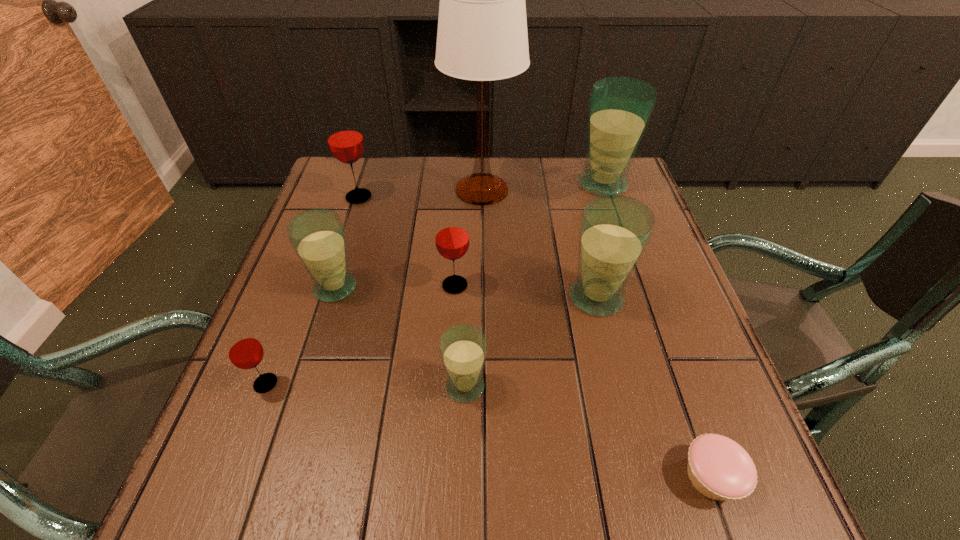
Where is `table lamp`? Image resolution: width=960 pixels, height=540 pixels. table lamp is located at coordinates [x=482, y=36].

Image resolution: width=960 pixels, height=540 pixels. I want to click on the farthest blue glass, so [x=620, y=108].

You are a GUI agent. You are given a task and a screenshot of the screen. Output one action in this format:
    pyautogui.click(x=<x>, y=<y>)
    Task: Click on the tallest glass
    
    Given the screenshot: What is the action you would take?
    pyautogui.click(x=620, y=108)

Where is `the biggest red glass`? the biggest red glass is located at coordinates (345, 140).

Find the location of a particular element. This screenshot has height=540, width=960. the second biggest blue glass is located at coordinates (614, 231).

You are a GUI agent. You are given a task and a screenshot of the screen. Output one action in this format:
    pyautogui.click(x=<x>, y=<y>)
    Task: Click on the rightmost red glass
    The height and width of the screenshot is (540, 960).
    Given the screenshot: What is the action you would take?
    pyautogui.click(x=452, y=240)

Where is `the second nearest red glass`? the second nearest red glass is located at coordinates (452, 240).

Identify the location of the leftmost blue glass. The width and height of the screenshot is (960, 540). (317, 235).

Identify the location of the nearest red glass. Image resolution: width=960 pixels, height=540 pixels. [244, 350].

Where is `the second blue glass from left to right`? The height and width of the screenshot is (540, 960). the second blue glass from left to right is located at coordinates (463, 348).